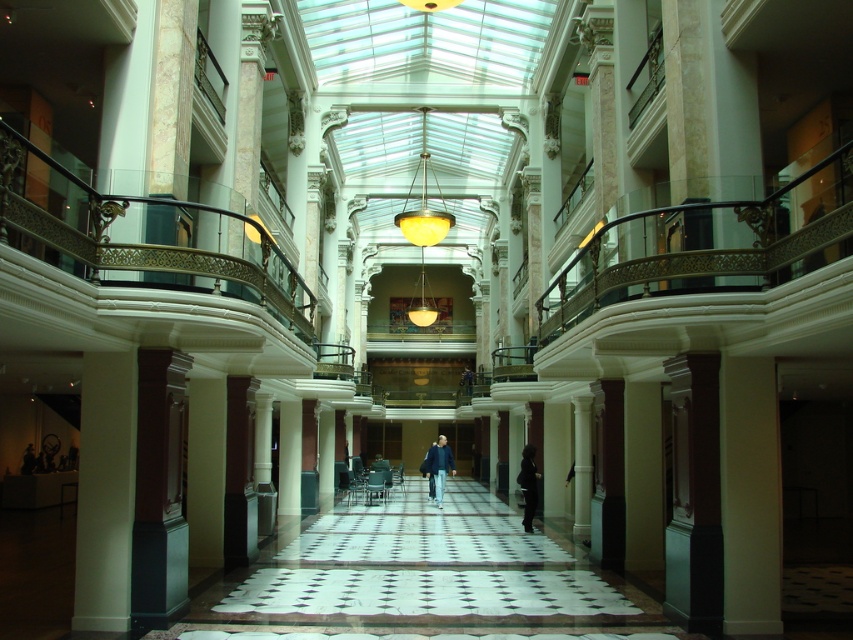
Question: Is the position of blue denim jacket at center more distant than that of dark gray fabric coat at center?

Choices:
 (A) no
 (B) yes

Answer: (B)

Question: Does blue denim jacket at center have a larger size compared to dark gray fabric coat at center?

Choices:
 (A) yes
 (B) no

Answer: (A)

Question: Does blue denim jacket at center have a smaller size compared to dark gray fabric coat at center?

Choices:
 (A) yes
 (B) no

Answer: (B)

Question: Among these points, which one is farthest from the camera?

Choices:
 (A) (532, 451)
 (B) (434, 467)

Answer: (B)

Question: Which point is closer to the camera?

Choices:
 (A) dark gray fabric coat at center
 (B) blue denim jacket at center

Answer: (A)